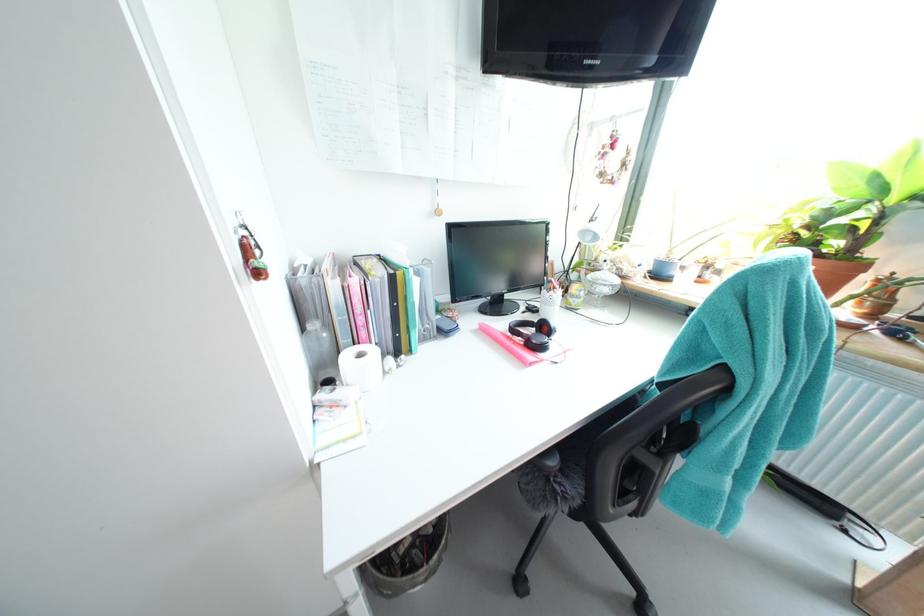
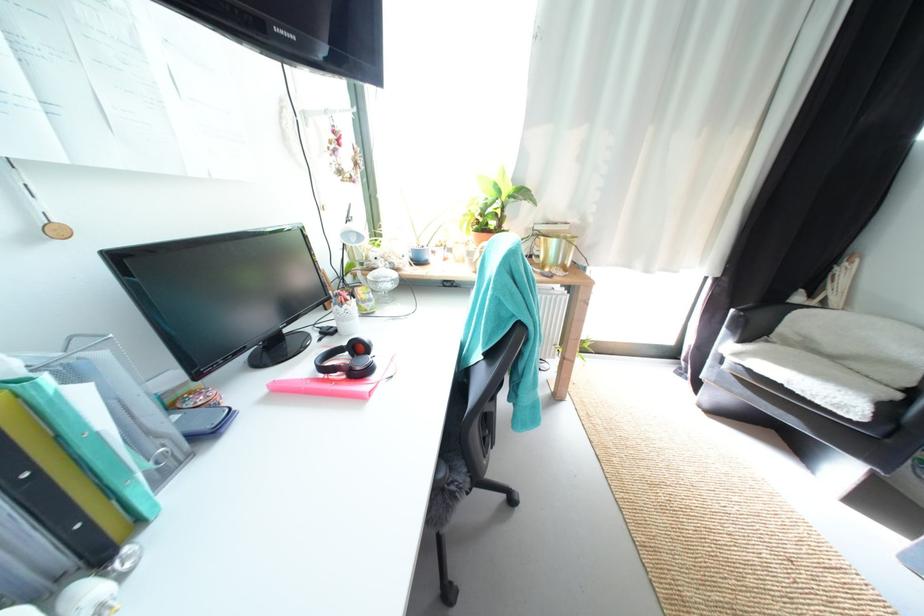
Find the pixel in the second image that matches (861,230) in the first image.

(505, 216)